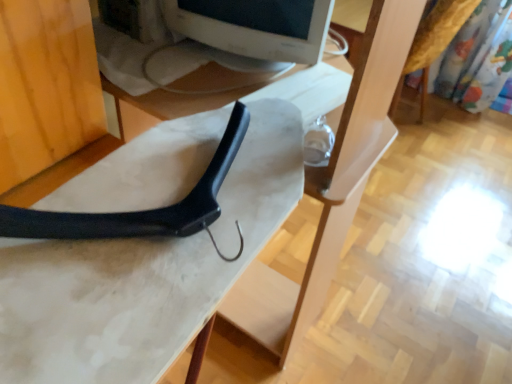
The image size is (512, 384). What do you see at coordinates (255, 27) in the screenshot? I see `white glossy computer monitor at upper center` at bounding box center [255, 27].

Where is `white glossy computer monitor at upper center`? The image size is (512, 384). white glossy computer monitor at upper center is located at coordinates (255, 27).

The image size is (512, 384). I want to click on white glossy computer monitor at upper center, so click(255, 27).